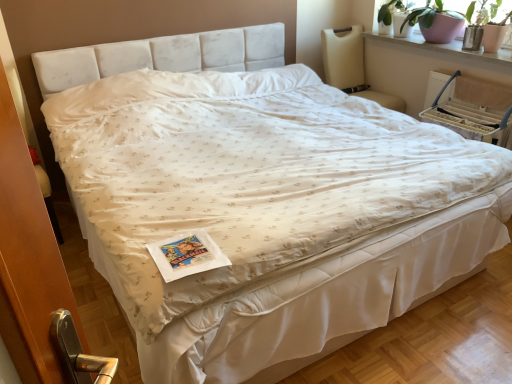
Question: Does point (428, 114) appear closer or farther from the camera than point (420, 31)?

Choices:
 (A) farther
 (B) closer

Answer: (B)

Question: From the image's perspective, is beige fabric armchair at upper right located above or below matte pink pot at upper right?

Choices:
 (A) above
 (B) below

Answer: (B)

Question: Which object is positioned closest to the beige fabric rocking chair at upper right?

Choices:
 (A) smooth white window sill at upper right
 (B) matte pink pot at upper right
 (C) beige fabric armchair at upper right

Answer: (A)

Question: Which of these objects is positioned farthest from the beige fabric rocking chair at upper right?

Choices:
 (A) beige fabric armchair at upper right
 (B) smooth white window sill at upper right
 (C) matte pink pot at upper right

Answer: (A)